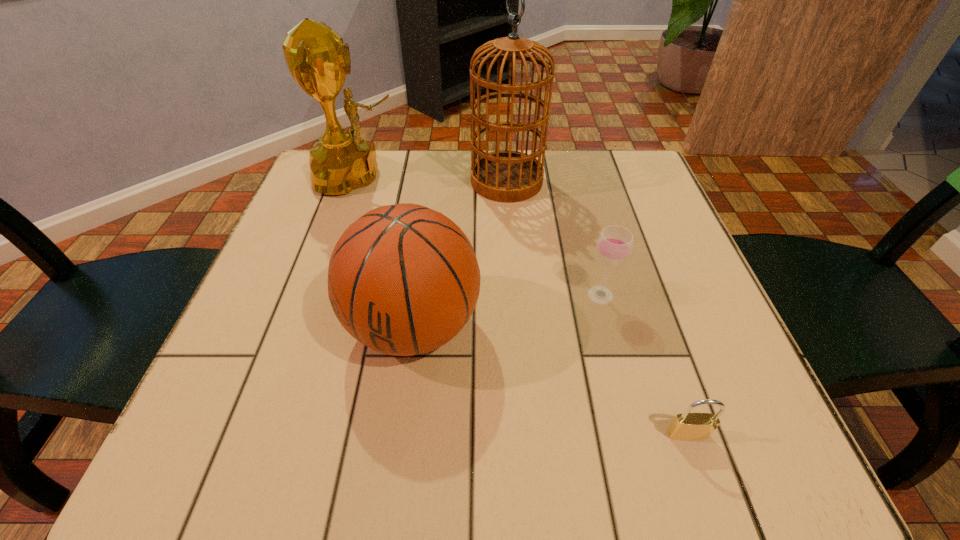
Locate an element on the screen. The width and height of the screenshot is (960, 540). free space between the wineglass and the basketball is located at coordinates (507, 311).

The width and height of the screenshot is (960, 540). What are the coordinates of `unoccupied position between the birdcage and the award` in the screenshot? It's located at (433, 179).

Image resolution: width=960 pixels, height=540 pixels. Find the location of `object that is the second closest to the third shortest object`. object that is the second closest to the third shortest object is located at coordinates (318, 60).

Point out which object is positioned as the third nearest to the basketball. Please provide its 2D coordinates. Your answer should be formatted as a tuple, i.e. [(x, y)], where the tuple contains the x and y coordinates of a point satisfying the conditions above.

[(508, 176)]

Where is `free space that satisfies the following two spatial constraints: 1. on the front side of the award; 2. on the back side of the wineglass`? This screenshot has width=960, height=540. free space that satisfies the following two spatial constraints: 1. on the front side of the award; 2. on the back side of the wineglass is located at coordinates (318, 295).

The height and width of the screenshot is (540, 960). In order to click on vacant space that satisfies the following two spatial constraints: 1. on the back side of the birdcage; 2. on the front side of the award in this screenshot , I will do `click(506, 177)`.

I want to click on free space that satisfies the following two spatial constraints: 1. on the front side of the award; 2. on the left side of the basketball, so click(x=307, y=327).

You are a GUI agent. You are given a task and a screenshot of the screen. Output one action in this format:
    pyautogui.click(x=<x>, y=<y>)
    Task: Click on the vacant space that satisfies the following two spatial constraints: 1. on the front side of the birdcage; 2. on the left side of the fourth tallest object
    This screenshot has height=540, width=960.
    Given the screenshot: What is the action you would take?
    pyautogui.click(x=515, y=295)

Where is `free space that satisfies the following two spatial constraints: 1. on the front side of the third shortest object; 2. on the left side of the fourth shortest object`? free space that satisfies the following two spatial constraints: 1. on the front side of the third shortest object; 2. on the left side of the fourth shortest object is located at coordinates (307, 327).